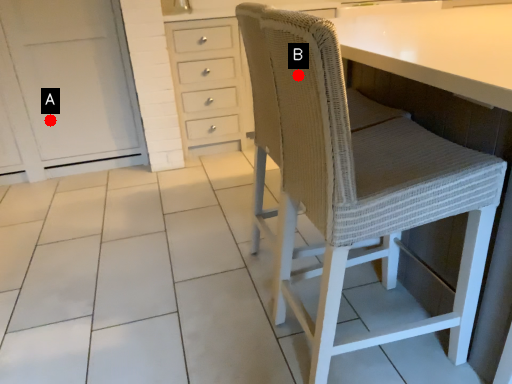
Question: Two points are circled on the image, labeled by A and B beside each circle. Among these points, which one is farthest from the camera?

Choices:
 (A) A is further
 (B) B is further

Answer: (A)